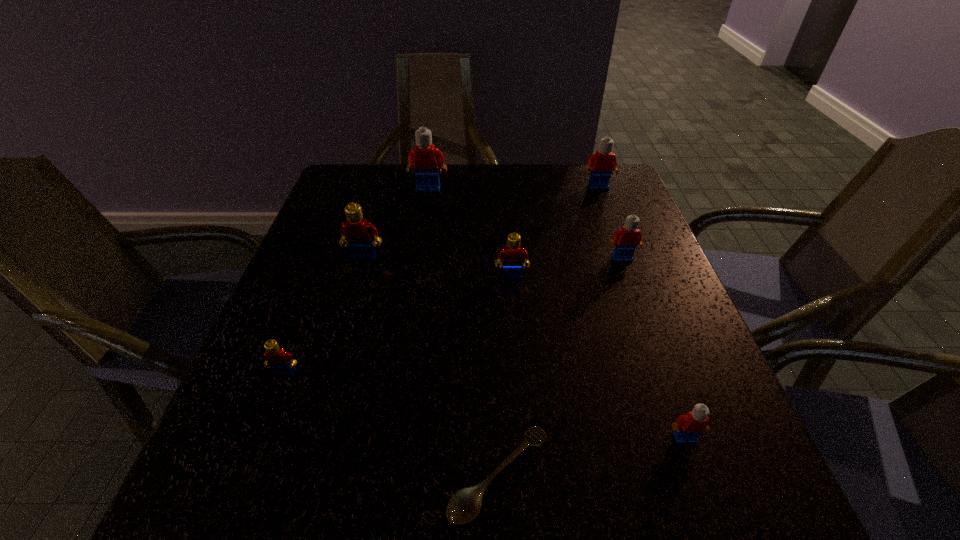
At what (x,y) coordinates should I click in order to perform the action: click on vacant space that's between the second biggest white Lego and the sixth Lego from right to left. Please return your answer as a coordinate pair (x, y). Image resolution: width=960 pixels, height=540 pixels. Looking at the image, I should click on (481, 222).

The image size is (960, 540). I want to click on vacant point located between the nearest white Lego and the third smallest white Lego, so click(x=641, y=313).

Find the location of a particular element. free space between the leftmost red Lego and the nearest Lego is located at coordinates (485, 406).

You are a GUI agent. You are given a task and a screenshot of the screen. Output one action in this format:
    pyautogui.click(x=<x>, y=<y>)
    Task: Click on the free spot between the tallest object and the third smallest white Lego
    The height and width of the screenshot is (540, 960).
    Given the screenshot: What is the action you would take?
    pyautogui.click(x=513, y=188)

At what (x,y) coordinates should I click in order to perform the action: click on vacant space that is in between the third smallest white Lego and the biggest red Lego. Please return your answer as a coordinate pair (x, y). The image size is (960, 540). Looking at the image, I should click on (481, 222).

You are a GUI agent. You are given a task and a screenshot of the screen. Output one action in this format:
    pyautogui.click(x=<x>, y=<y>)
    Task: Click on the vacant area that lies between the smallest white Lego and the third nearest object
    
    Given the screenshot: What is the action you would take?
    pyautogui.click(x=485, y=406)

This screenshot has height=540, width=960. I want to click on free space that is in between the smallest white Lego and the tallest Lego, so click(x=557, y=313).

Find the location of a particular element. The height and width of the screenshot is (540, 960). blank region between the nearest Lego and the shortest object is located at coordinates (592, 456).

The image size is (960, 540). In order to click on unoccupied position between the second biggest red Lego and the ladle in this screenshot , I will do `click(505, 376)`.

Locate an element on the screen. object that can be found as the second closest to the second biggest white Lego is located at coordinates (426, 158).